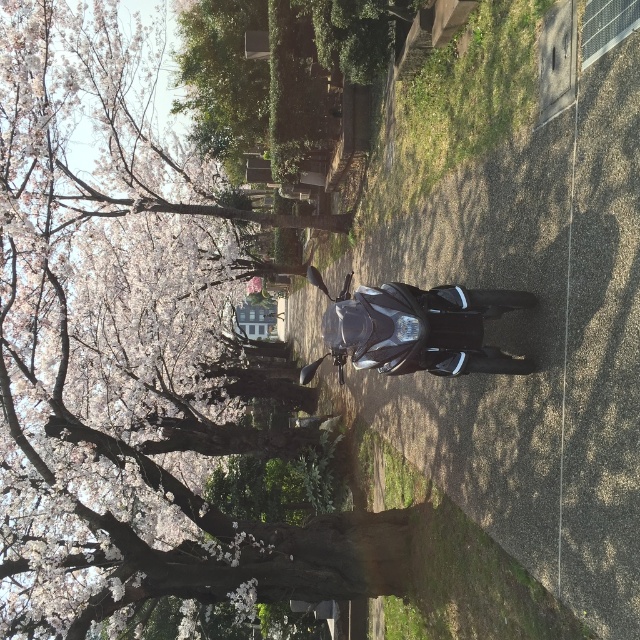
You are a photographer planning to capture a wide shot of the glossy black motorcycle at center and the smooth bark tree at center. Given their sizes, which object will occupy more space in your photo?

The smooth bark tree at center is larger in size than the glossy black motorcycle at center, so it will occupy more space in the photo.